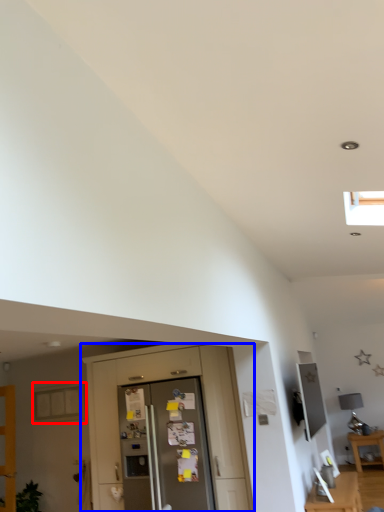
Question: Among these objects, which one is farthest to the camera, window (highlighted by a red box) or dresser (highlighted by a blue box)?

Choices:
 (A) window
 (B) dresser

Answer: (A)